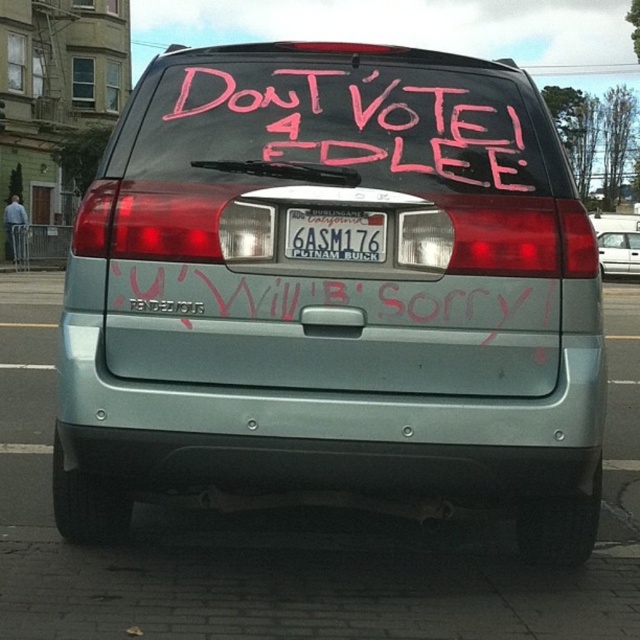
From the picture: Can you confirm if satin silver minivan at center is bigger than white plastic license plate at center?

Indeed, satin silver minivan at center has a larger size compared to white plastic license plate at center.

Is satin silver minivan at center shorter than white plastic license plate at center?

No.

I want to click on satin silver minivan at center, so click(x=333, y=296).

Does white plastic license plate at center appear on the right side of satin silver sedan at center?

In fact, white plastic license plate at center is to the left of satin silver sedan at center.

This screenshot has height=640, width=640. Describe the element at coordinates (336, 234) in the screenshot. I see `white plastic license plate at center` at that location.

Is point (307, 240) less distant than point (611, 221)?

That is True.

Image resolution: width=640 pixels, height=640 pixels. I want to click on white plastic license plate at center, so click(x=336, y=234).

Can you confirm if satin silver minivan at center is positioned to the left of pink chalk writing at center?

Incorrect, satin silver minivan at center is not on the left side of pink chalk writing at center.

Does satin silver minivan at center lie behind pink chalk writing at center?

No, it is in front of pink chalk writing at center.

The width and height of the screenshot is (640, 640). Describe the element at coordinates (333, 296) in the screenshot. I see `satin silver minivan at center` at that location.

Where is `satin silver minivan at center`? This screenshot has width=640, height=640. satin silver minivan at center is located at coordinates (333, 296).